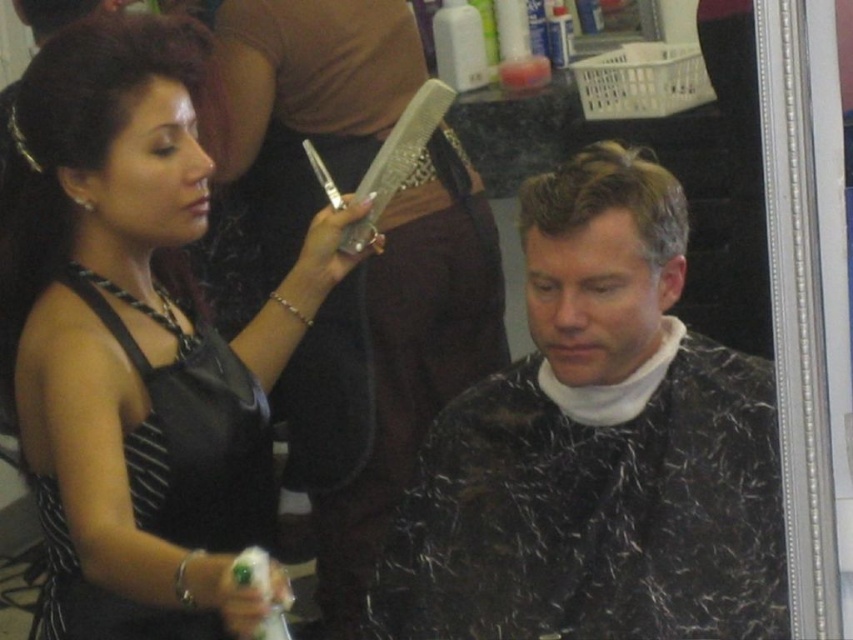
You are a customer entering a barbershop and see the black leather dress at upper left hanging on the wall. If you want to reach it, will you be able to do so without a ladder?

The black leather dress at upper left is 3.61 feet away from the viewer. Since the average person can reach up to about 6.5 feet, you can easily reach it without needing a ladder.